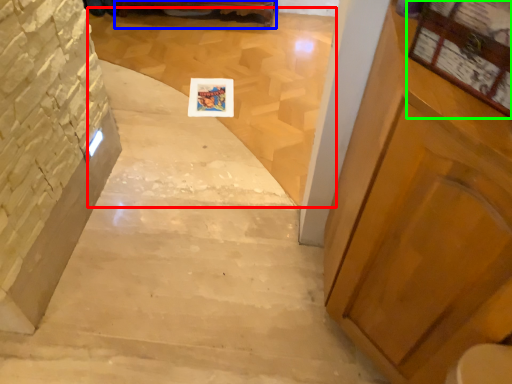
Question: Based on their relative distances, which object is farther from stairwell (highlighted by a red box)? Choose from furniture (highlighted by a blue box) and bulletin board (highlighted by a green box).

Choices:
 (A) furniture
 (B) bulletin board

Answer: (B)